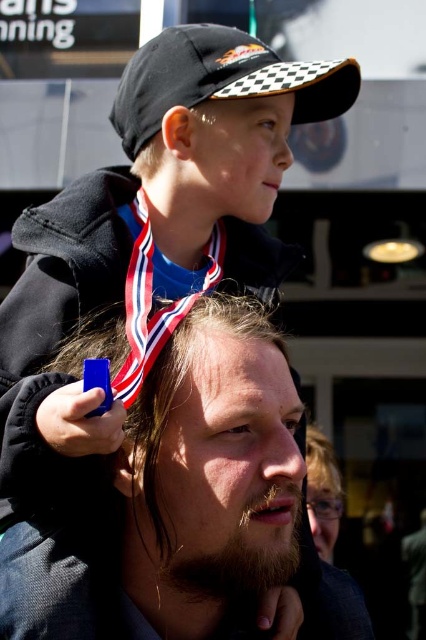
Based on the photo, can you confirm if black checkered baseball cap at upper center is wider than matte blue neck at center?

Indeed, black checkered baseball cap at upper center has a greater width compared to matte blue neck at center.

Is black checkered baseball cap at upper center positioned behind matte blue neck at center?

Yes, black checkered baseball cap at upper center is behind matte blue neck at center.

You are a GUI agent. You are given a task and a screenshot of the screen. Output one action in this format:
    pyautogui.click(x=<x>, y=<y>)
    Task: Click on the black checkered baseball cap at upper center
    
    Given the screenshot: What is the action you would take?
    pyautogui.click(x=221, y=80)

Find the location of a particular element. black checkered baseball cap at upper center is located at coordinates (221, 80).

Which is in front, point (157, 486) or point (123, 97)?

Point (157, 486)

Based on the photo, is dark brown textured hair at center positioned in front of black checkered baseball cap at upper center?

Yes, dark brown textured hair at center is in front of black checkered baseball cap at upper center.

The width and height of the screenshot is (426, 640). Describe the element at coordinates (209, 452) in the screenshot. I see `dark brown textured hair at center` at that location.

At what (x,y) coordinates should I click in order to perform the action: click on dark brown textured hair at center. Please return your answer as a coordinate pair (x, y). Looking at the image, I should click on (209, 452).

Does dark brown textured hair at center appear on the left side of matte blue neck at center?

No, dark brown textured hair at center is not to the left of matte blue neck at center.

The width and height of the screenshot is (426, 640). I want to click on dark brown textured hair at center, so click(209, 452).